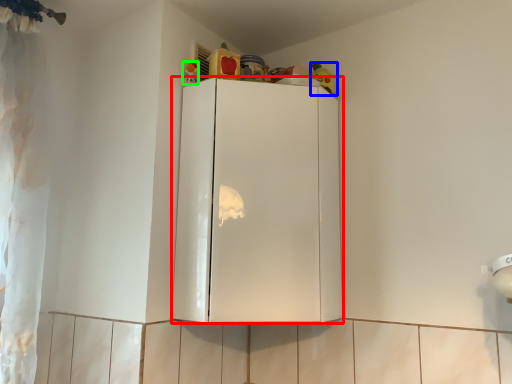
Question: Which object is the farthest from cabinetry (highlighted by a red box)? Choose among these: toy (highlighted by a blue box) or toy (highlighted by a green box).

Choices:
 (A) toy
 (B) toy

Answer: (A)